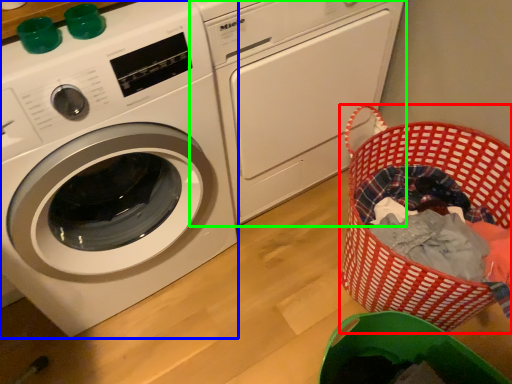
Question: Based on their relative distances, which object is farther from basket (highlighted by a red box)? Choose from washing machine (highlighted by a blue box) and washing machine (highlighted by a green box).

Choices:
 (A) washing machine
 (B) washing machine

Answer: (A)